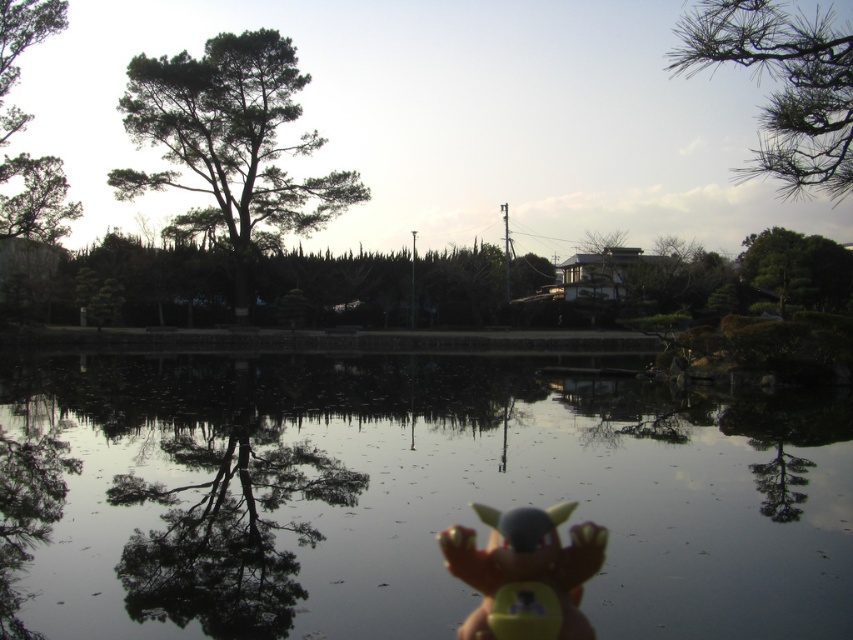
Which is more to the right, green leafy tree at upper left or green needle-like branches at upper right?

green needle-like branches at upper right

Does green leafy tree at upper left appear on the right side of green needle-like branches at upper right?

No, green leafy tree at upper left is not to the right of green needle-like branches at upper right.

Is point (320, 220) closer to camera compared to point (846, 60)?

That is False.

Locate an element on the screen. green leafy tree at upper left is located at coordinates (230, 144).

Find the location of a particular element. This screenshot has height=640, width=853. green leafy tree at upper left is located at coordinates (230, 144).

Between green leafy tree at upper left and matte yellow toy at bottom center, which one has less height?

matte yellow toy at bottom center

Where is `green leafy tree at upper left`? The width and height of the screenshot is (853, 640). green leafy tree at upper left is located at coordinates (230, 144).

Which is above, transparent water at center or matte yellow toy at bottom center?

matte yellow toy at bottom center

The height and width of the screenshot is (640, 853). Find the location of `transparent water at center`. transparent water at center is located at coordinates (404, 497).

Does point (320, 508) come in front of point (502, 540)?

No, it is behind (502, 540).

Locate an element on the screen. This screenshot has width=853, height=640. transparent water at center is located at coordinates (404, 497).